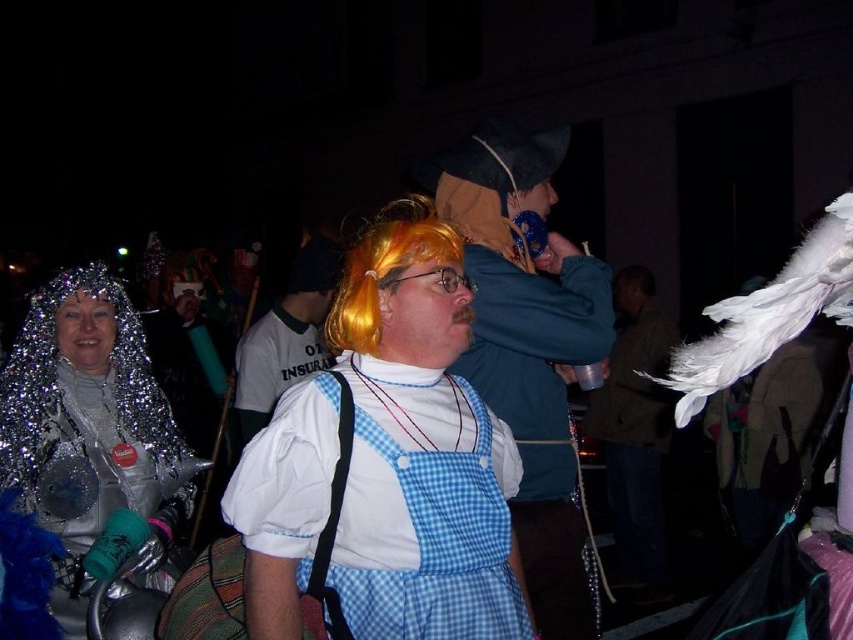
Which is below, sparkly silver headpiece at upper left or blue checkered overalls at center?

sparkly silver headpiece at upper left

Does sparkly silver headpiece at upper left appear on the left side of blue checkered overalls at center?

Indeed, sparkly silver headpiece at upper left is positioned on the left side of blue checkered overalls at center.

What are the coordinates of `sparkly silver headpiece at upper left` in the screenshot? It's located at (80, 454).

Where is `sparkly silver headpiece at upper left`? Image resolution: width=853 pixels, height=640 pixels. sparkly silver headpiece at upper left is located at coordinates (80, 454).

Does blue checkered overalls at center have a larger size compared to orange wig at center?

Yes.

Which is in front, point (482, 396) or point (302, 284)?

Positioned in front is point (482, 396).

At what (x,y) coordinates should I click in order to perform the action: click on blue checkered overalls at center. Please return your answer as a coordinate pair (x, y). Looking at the image, I should click on (531, 348).

This screenshot has width=853, height=640. What do you see at coordinates (421, 448) in the screenshot?
I see `shiny metallic wig at center` at bounding box center [421, 448].

Does shiny metallic wig at center have a smaller size compared to orange synthetic wig at center?

Incorrect, shiny metallic wig at center is not smaller in size than orange synthetic wig at center.

Does point (440, 276) come behind point (370, 259)?

No, it is not.

Locate an element on the screen. shiny metallic wig at center is located at coordinates (421, 448).